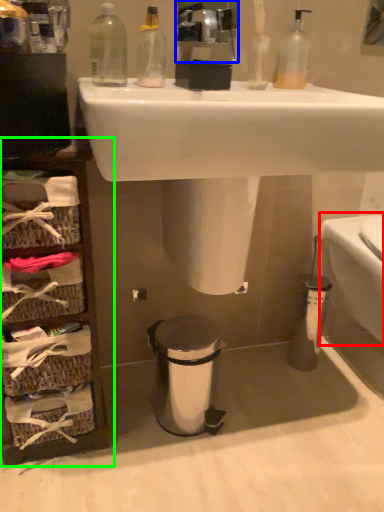
Question: Which object is positioned farthest from toilet bowl (highlighted by a red box)? Select from mirror (highlighted by a blue box) and cabinet (highlighted by a green box).

Choices:
 (A) mirror
 (B) cabinet

Answer: (B)